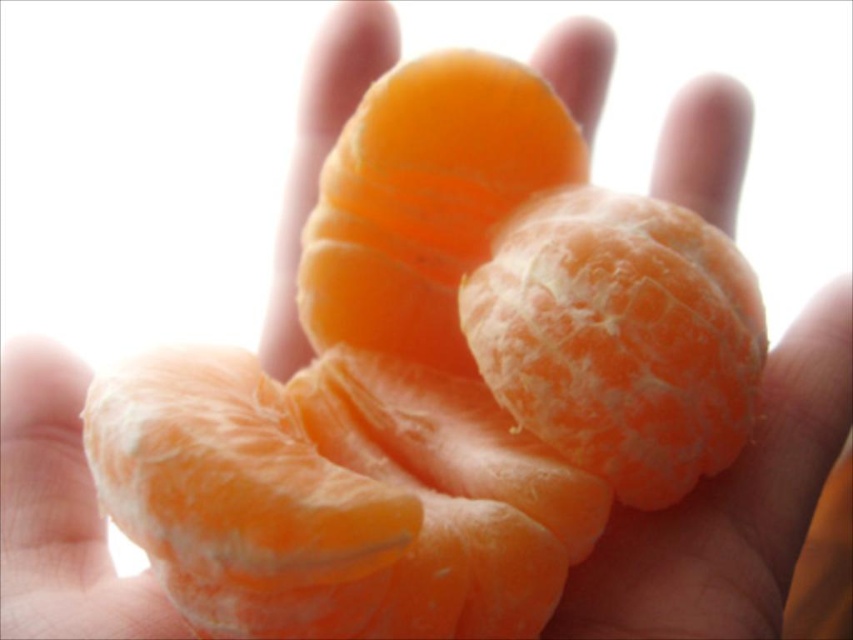
Looking at the image of the hand holding orange segments, which object is positioned to the right of the other between the orange matte tangerine at center and the orangesmoothorange segment at center?

The orange matte tangerine at center is positioned to the right of the orangesmoothorange segment at center.

You are trying to pick up an orange segment from the image. The orange segments are located at point (613, 426) and point (500, 150). Which point should you aim for if you want to pick the segment that is closer to you?

Point (613, 426) is closer to the viewer than point (500, 150), so you should aim for point (613, 426).

You are a food stylist arranging a still life with the orange matte tangerine at center and the orangesmoothorange segment at center. The client wants to know if the two items can be placed side by side without overlapping. Given that the display area is 10 inches wide, will they fit?

The distance between the orange matte tangerine at center and orangesmoothorange segment at center is 8.70 inches. Since the display area is 10 inches wide, they can be placed side by side without overlapping as there is enough space.